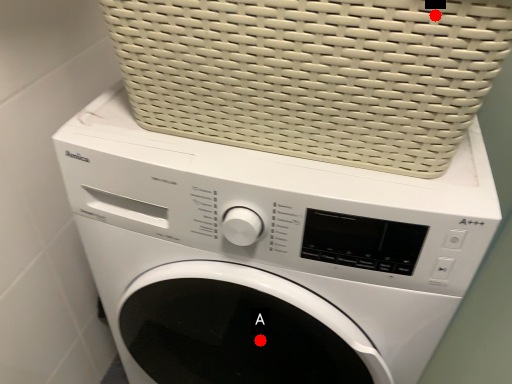
Question: Two points are circled on the image, labeled by A and B beside each circle. Which point is farther from the camera taking this photo?

Choices:
 (A) A is further
 (B) B is further

Answer: (A)